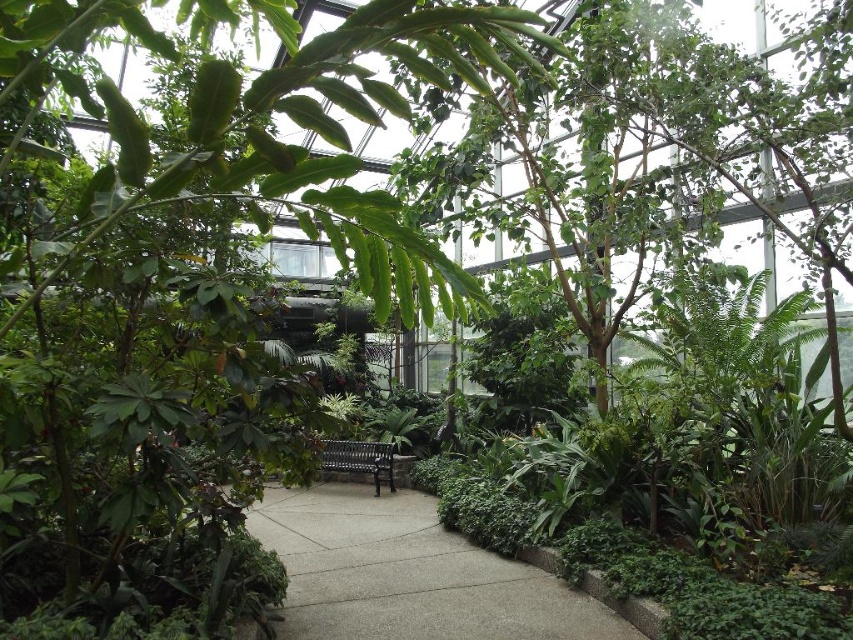
Who is positioned more to the left, concrete at center or black metal bench at center?

Positioned to the left is black metal bench at center.

Which is in front, point (305, 493) or point (364, 472)?

Point (305, 493) is in front.

Locate an element on the screen. concrete at center is located at coordinates [415, 573].

Does green leafy tree at center appear on the left side of black metal bench at center?

Correct, you'll find green leafy tree at center to the left of black metal bench at center.

Can you confirm if green leafy tree at center is thinner than black metal bench at center?

Incorrect, green leafy tree at center's width is not less than black metal bench at center's.

Does point (41, 250) come closer to viewer compared to point (361, 461)?

Yes, point (41, 250) is closer to viewer.

Identify the location of green leafy tree at center. This screenshot has width=853, height=640. pyautogui.click(x=190, y=289).

Can you confirm if green leafy tree at center is positioned above concrete at center?

Correct, green leafy tree at center is located above concrete at center.

Between point (28, 221) and point (432, 605), which one is positioned in front?

Point (28, 221) is more forward.

I want to click on green leafy tree at center, so click(x=190, y=289).